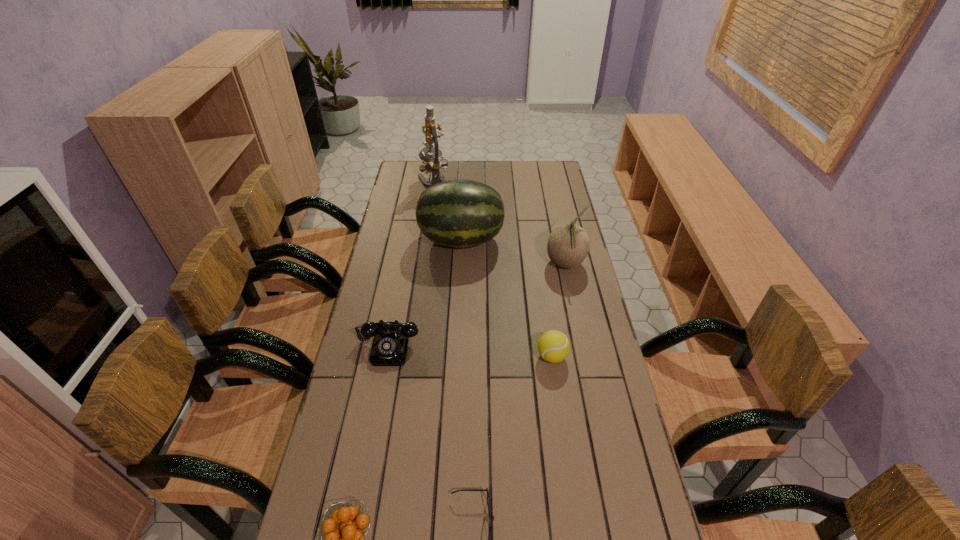
I want to click on free region at the right edge of the desktop, so click(602, 369).

The image size is (960, 540). In order to click on vacant space at the far left corner of the desktop in this screenshot , I will do `click(410, 163)`.

This screenshot has width=960, height=540. Find the location of `vacant space at the far right corner`. vacant space at the far right corner is located at coordinates (561, 177).

Identify the location of vacant area between the fifth shortest object and the tennis ball. This screenshot has width=960, height=540. (559, 310).

At what (x,y) coordinates should I click in order to perform the action: click on free space between the telephone and the watermelon. Please return your answer as a coordinate pair (x, y). Image resolution: width=960 pixels, height=540 pixels. Looking at the image, I should click on (425, 293).

What are the coordinates of `free spot between the watermelon and the telephone` in the screenshot? It's located at (425, 293).

The height and width of the screenshot is (540, 960). I want to click on vacant area between the tennis ball and the watermelon, so click(507, 298).

Locate which object is the fourth closest to the tallest object. Please provide its 2D coordinates. Your answer should be formatted as a tuple, i.e. [(x, y)], where the tuple contains the x and y coordinates of a point satisfying the conditions above.

[(553, 346)]

Point out which object is positioned as the third nearest to the fifth shortest object. Please provide its 2D coordinates. Your answer should be formatted as a tuple, i.e. [(x, y)], where the tuple contains the x and y coordinates of a point satisfying the conditions above.

[(390, 344)]

Find the location of a particular element. The height and width of the screenshot is (540, 960). free space that satisfies the following two spatial constraints: 1. on the dial of the telephone; 2. on the left side of the tennis ball is located at coordinates (387, 356).